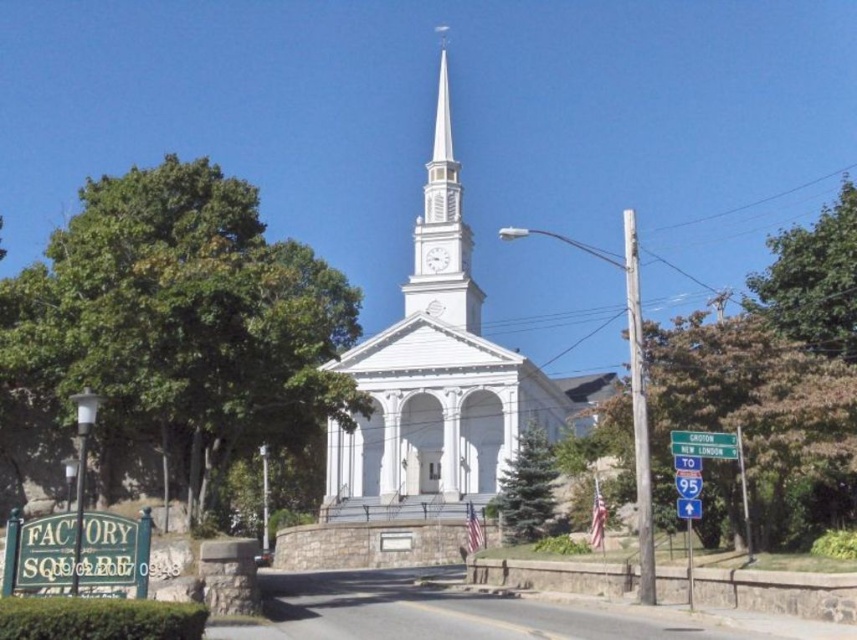
Between point (789, 412) and point (835, 272), which one is positioned in front?

Point (789, 412) is in front.

Is point (820, 454) positioned after point (820, 216)?

No, (820, 454) is in front of (820, 216).

I want to click on brown textured tree at right, so click(x=757, y=420).

This screenshot has width=857, height=640. What are the coordinates of `brown textured tree at right` in the screenshot? It's located at (757, 420).

Can you confirm if brown textured tree at right is positioned to the right of white smooth steeple at center?

Indeed, brown textured tree at right is positioned on the right side of white smooth steeple at center.

Is brown textured tree at right behind white smooth steeple at center?

No, it is in front of white smooth steeple at center.

Between point (664, 419) and point (421, 227), which one is positioned behind?

The point (421, 227) is more distant.

Locate an element on the screen. brown textured tree at right is located at coordinates (757, 420).

Does green leafy tree at upper right appear on the left side of white smooth steeple at center?

Incorrect, green leafy tree at upper right is not on the left side of white smooth steeple at center.

Is point (801, 250) behind point (460, 204)?

No, (801, 250) is closer to viewer.

Where is `green leafy tree at upper right`? green leafy tree at upper right is located at coordinates (812, 280).